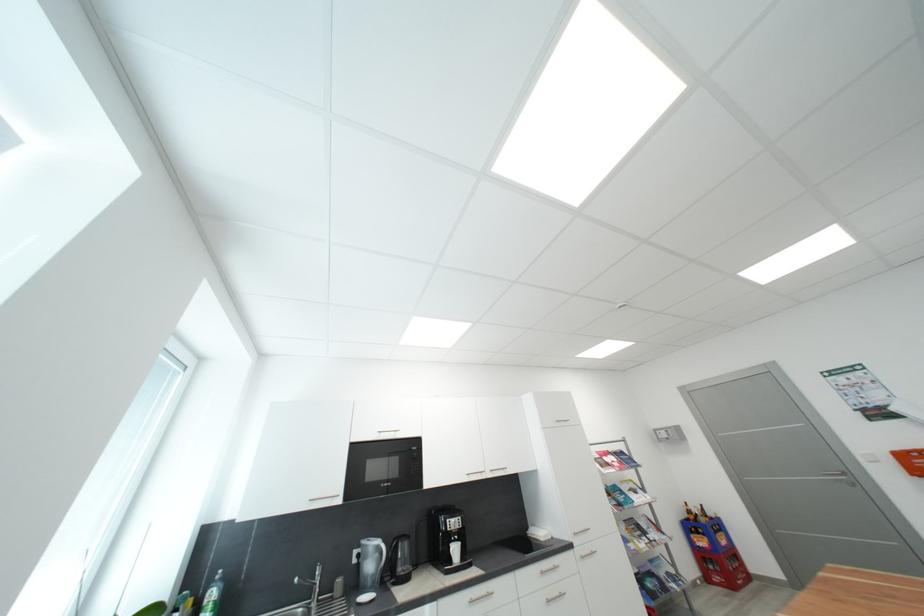
The height and width of the screenshot is (616, 924). Describe the element at coordinates (397, 567) in the screenshot. I see `the black kettle handle` at that location.